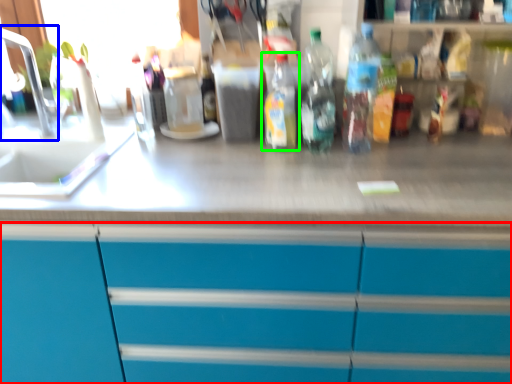
Question: Based on their relative distances, which object is farther from cabinetry (highlighted by a red box)? Choose from faucet (highlighted by a blue box) and bottle (highlighted by a green box).

Choices:
 (A) faucet
 (B) bottle

Answer: (A)